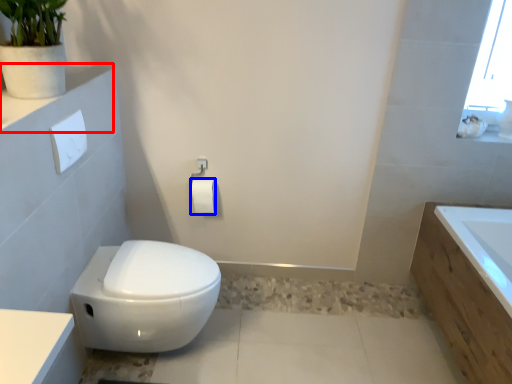
Question: Which object appears farthest to the camera in this image, ledge (highlighted by a red box) or toilet paper (highlighted by a blue box)?

Choices:
 (A) ledge
 (B) toilet paper

Answer: (B)